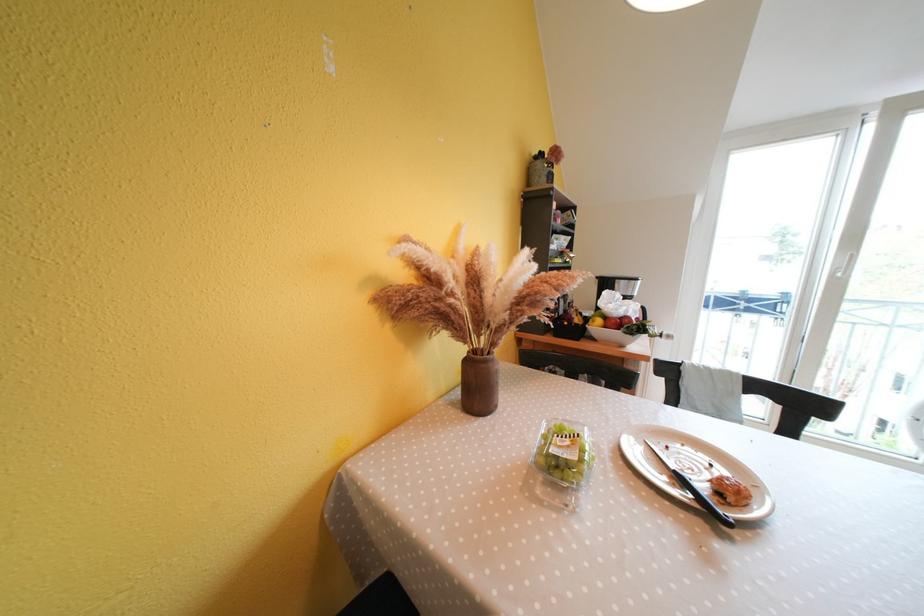
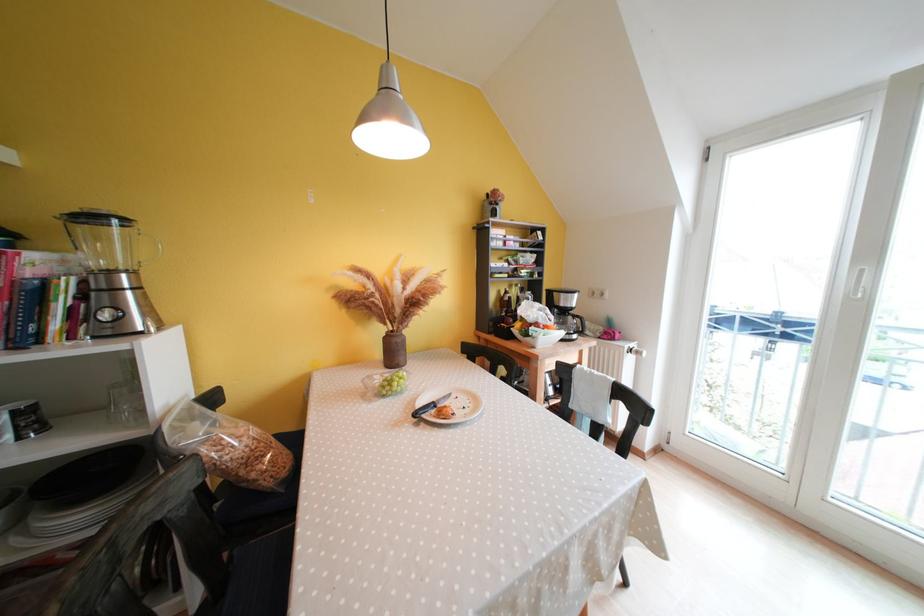
Question: Which direction would the cameraman need to move to produce the second image? Reply with the corresponding letter.

Choices:
 (A) Left
 (B) Right
 (C) Forward
 (D) Backward

Answer: (B)